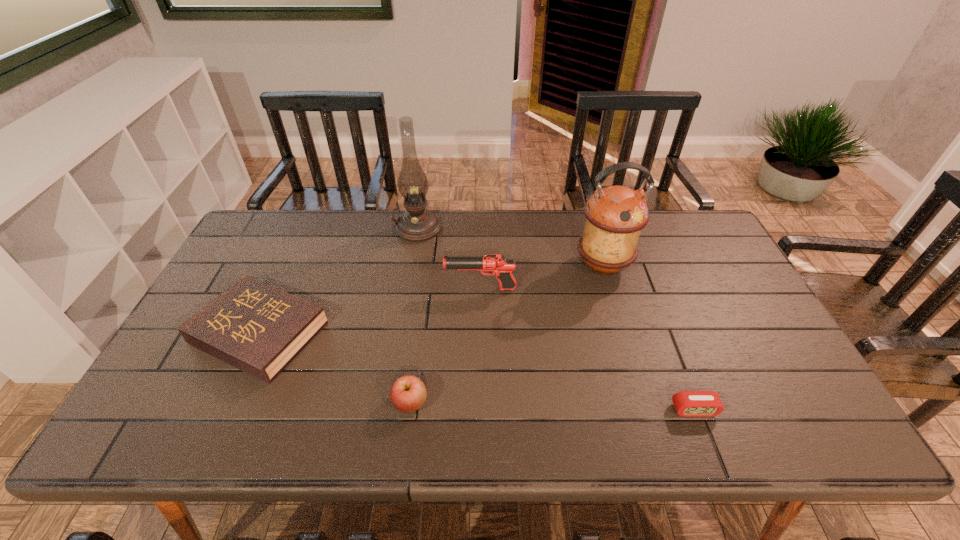
Image resolution: width=960 pixels, height=540 pixels. What are the coordinates of `vacant space located on the front of the nearer oil lamp` in the screenshot? It's located at (640, 394).

Find the location of a particular element. The width and height of the screenshot is (960, 540). blank space located 0.350m at the aiming end of the gun is located at coordinates (325, 288).

At what (x,y) coordinates should I click in order to perform the action: click on free region located at the aiming end of the gun. Please return your answer as a coordinate pair (x, y). Looking at the image, I should click on (387, 288).

The height and width of the screenshot is (540, 960). Identify the location of vacant space situated at the aiming end of the gun. (373, 288).

Locate an element on the screen. The height and width of the screenshot is (540, 960). free spot located 0.300m on the left of the third shortest object is located at coordinates (263, 403).

Identify the location of vacant space located on the right of the second shortest object. (453, 333).

At what (x,y) coordinates should I click in order to perform the action: click on apple present at the near edge. Please return your answer as a coordinate pair (x, y). The image size is (960, 540). Looking at the image, I should click on (408, 393).

Find the location of a particular element. The width and height of the screenshot is (960, 540). alarm clock located at the near edge is located at coordinates (687, 403).

At what (x,y) coordinates should I click in order to perform the action: click on object that is positioned at the left edge. Please return your answer as a coordinate pair (x, y). The width and height of the screenshot is (960, 540). Looking at the image, I should click on (256, 328).

Where is `vacant region at the far edge`? vacant region at the far edge is located at coordinates (564, 219).